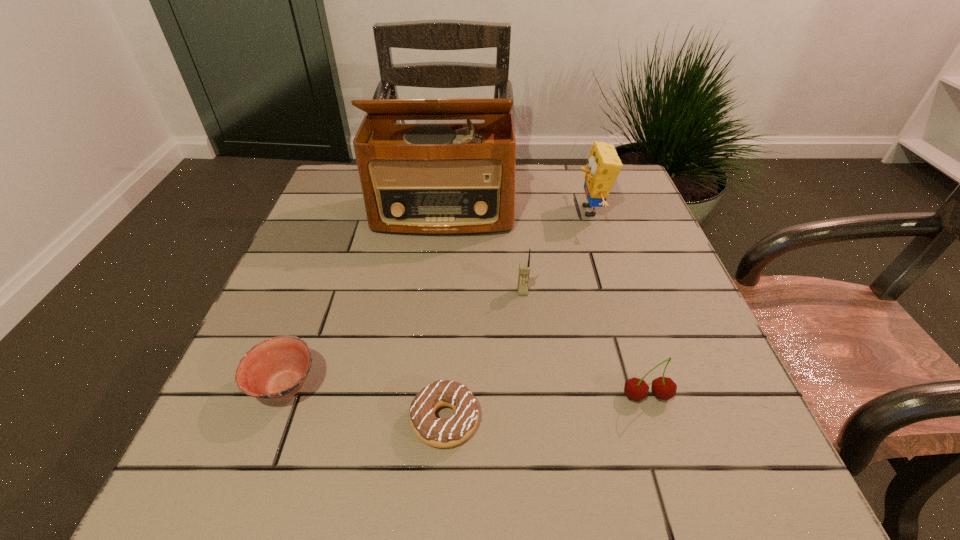
Locate an element on the screen. This screenshot has width=960, height=540. vacant space that satisfies the following two spatial constraints: 1. on the face of the second tallest object; 2. on the surface of the cherry is located at coordinates (649, 396).

Find the location of a particular element. This screenshot has width=960, height=540. blank space that satisfies the following two spatial constraints: 1. on the face of the fifth shortest object; 2. on the surface of the cherry is located at coordinates (649, 396).

In order to click on free location that satisfies the following two spatial constraints: 1. on the face of the sponge; 2. on the front side of the doughnut in this screenshot , I will do `click(656, 420)`.